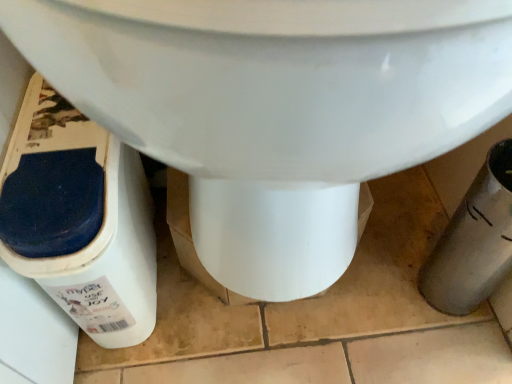
Locate an element on the screen. This screenshot has height=384, width=512. free space above white plastic potty at lower left (from a real-world perspective) is located at coordinates (47, 155).